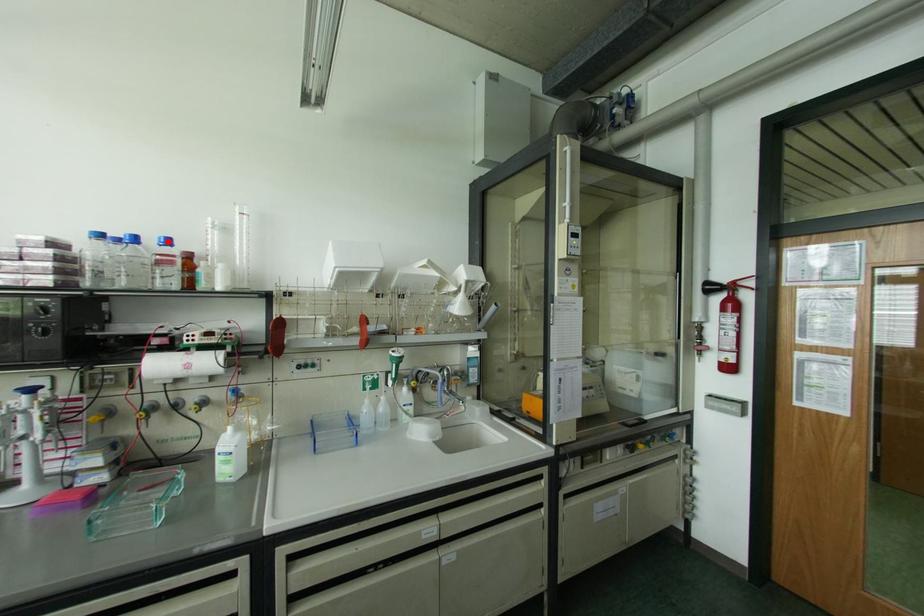
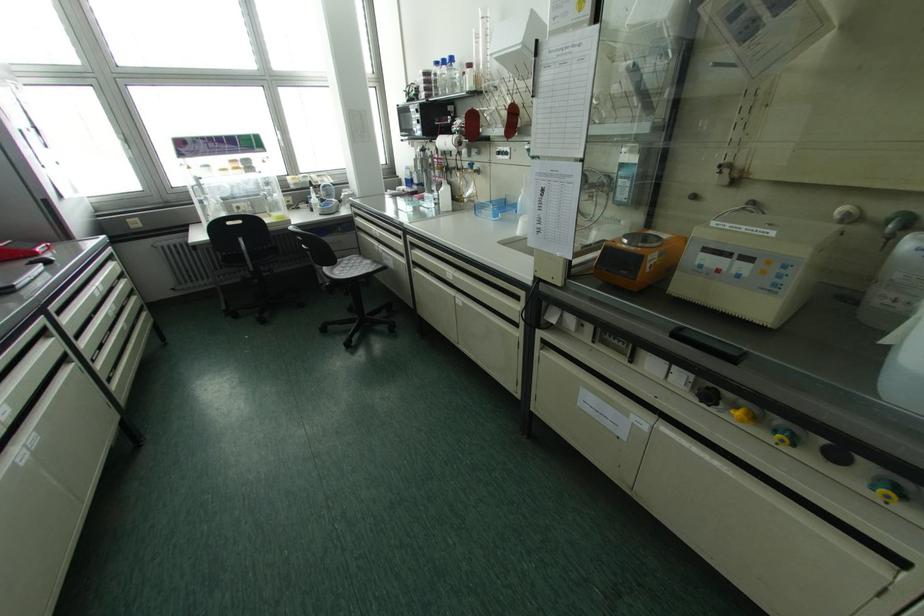
Locate, in the second image, the point that corresponds to the highlighted location in the first image.

(451, 59)